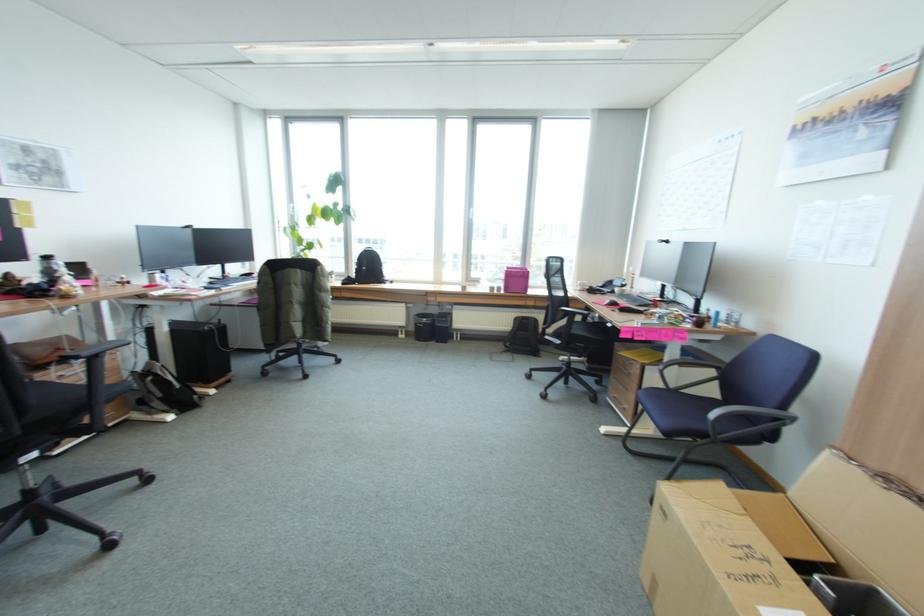
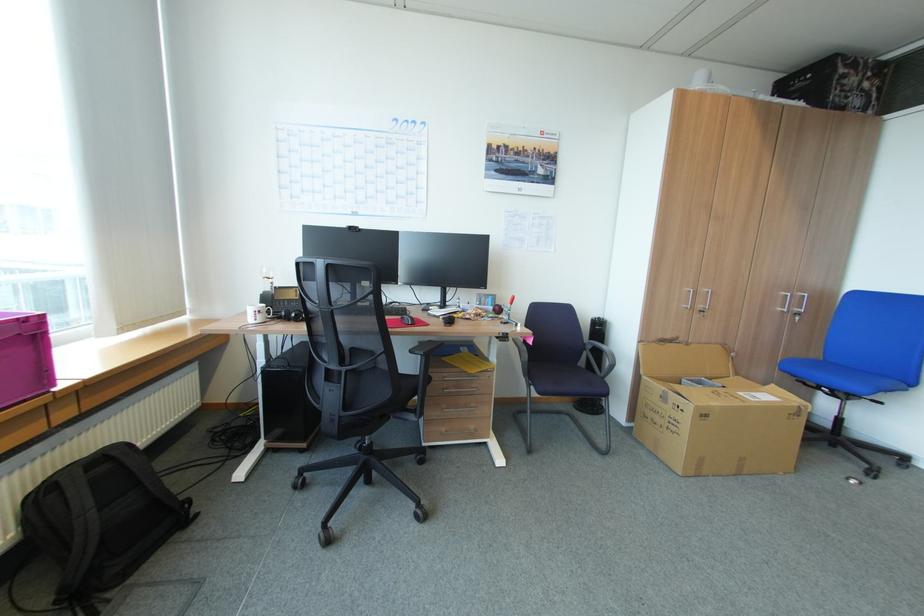
The point at (529, 272) is marked in the first image. Where is the corresponding point in the second image?

(29, 321)